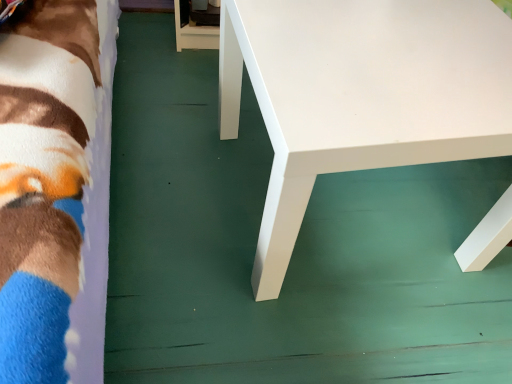
Locate an element on the screen. This screenshot has height=384, width=512. blank space situated above white matte table at center (from a real-world perspective) is located at coordinates (401, 42).